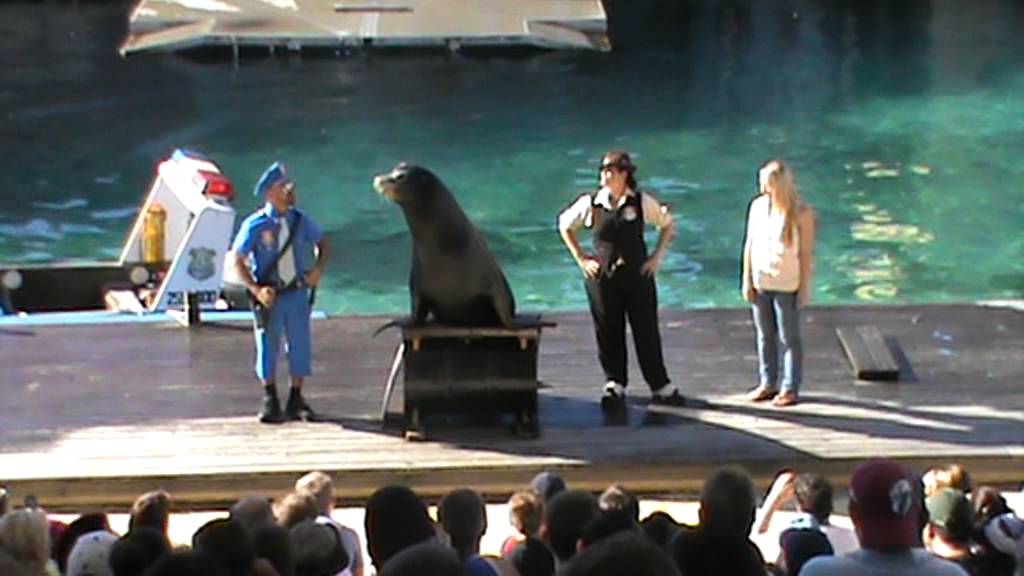
I want to click on red light, so click(203, 172).